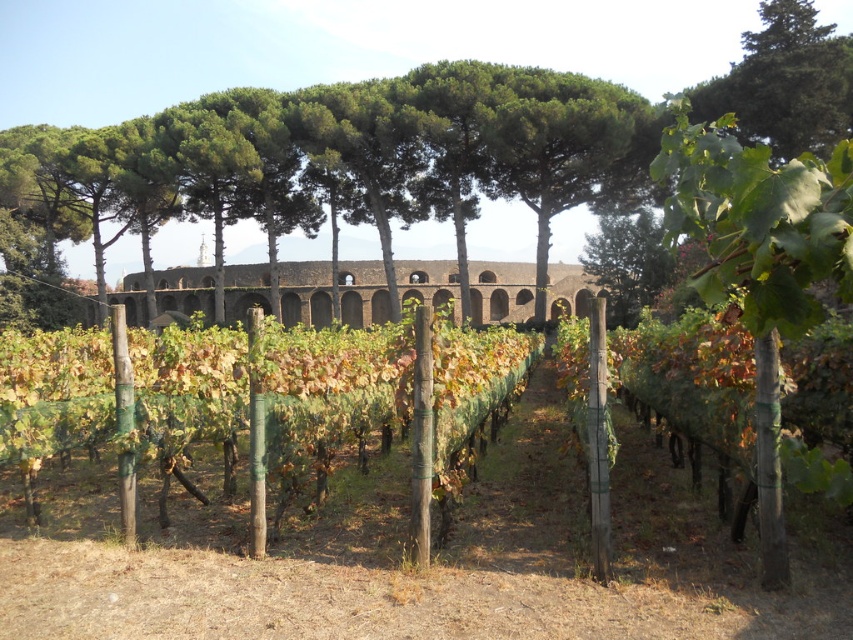
You are a tourist standing in the vineyard and want to take a photo of the green leafy vine at right and the brown stone viaduct at center. Which object should you frame first in your camera to ensure both are in the shot?

You should frame the brown stone viaduct at center first because the green leafy vine at right is positioned on the right side of it, meaning the vine is to the right of the viaduct. By centering the viaduct, you can then adjust the camera to include the vine on its right side in the frame.

You are planning to install a new irrigation system in the vineyard. The system requires a clear area that is not occupied by the green leafy vine at right or the brown stone viaduct at center. Based on the scene, which object takes up more space and would require more consideration for planning around?

The brown stone viaduct at center occupies more space than the green leafy vine at right, so it would require more consideration for planning around.